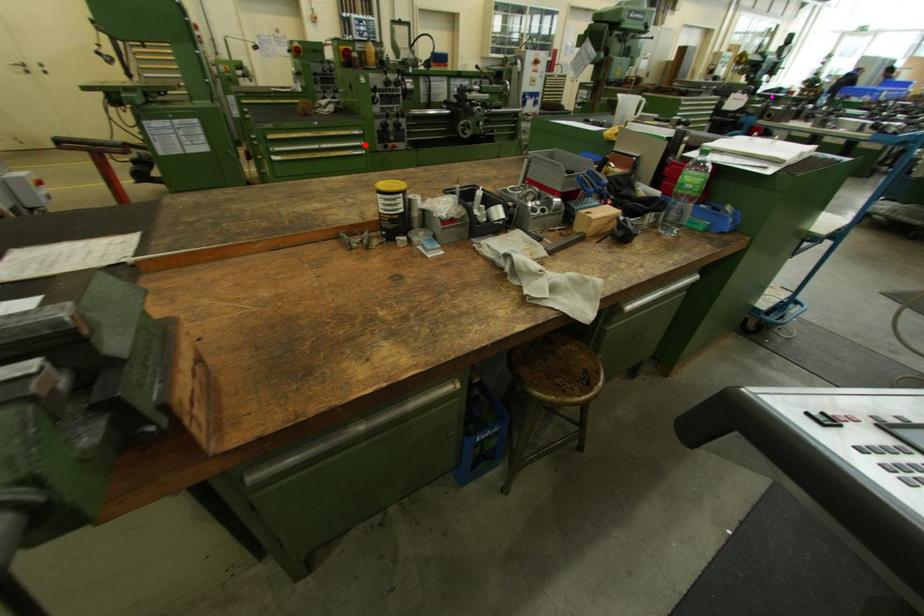
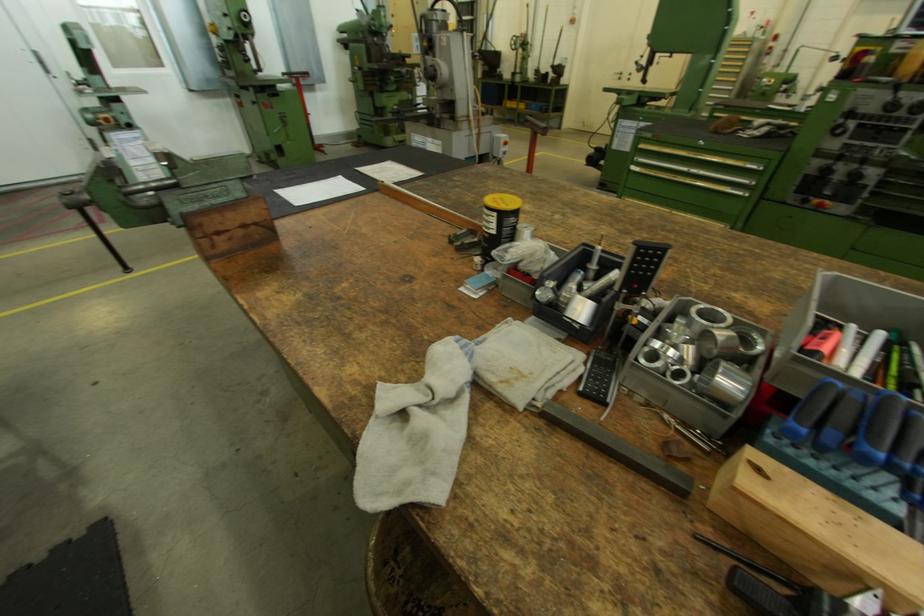
Locate, in the second image, the point that corresponds to the highlighted location in the first image.

(752, 183)